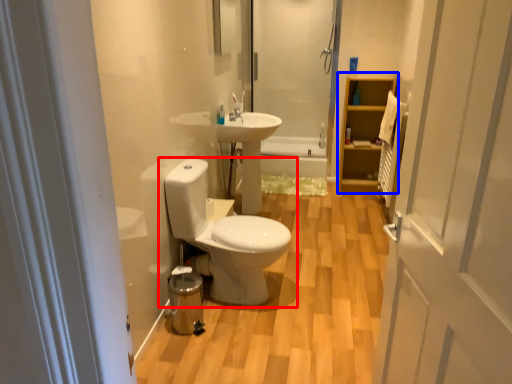
Question: Which point is closer to the camera, toilet (highlighted by a red box) or cabinet (highlighted by a blue box)?

Choices:
 (A) toilet
 (B) cabinet

Answer: (A)